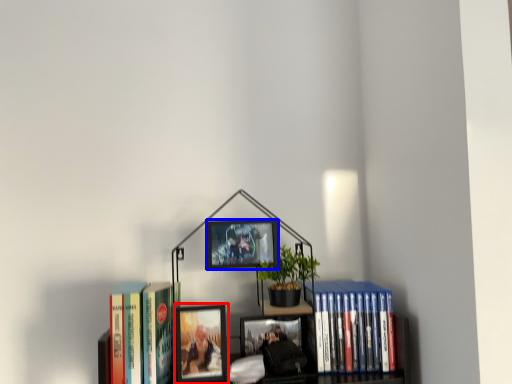
Question: Which point is closer to the camera, picture frame (highlighted by a red box) or picture frame (highlighted by a blue box)?

Choices:
 (A) picture frame
 (B) picture frame

Answer: (A)